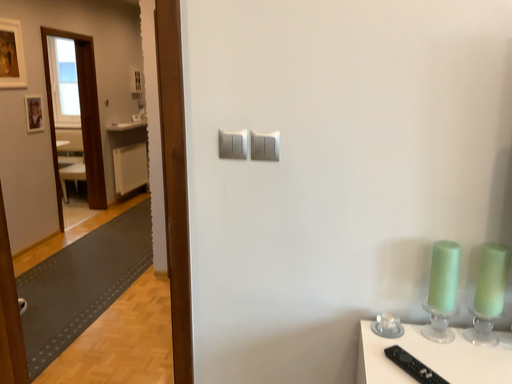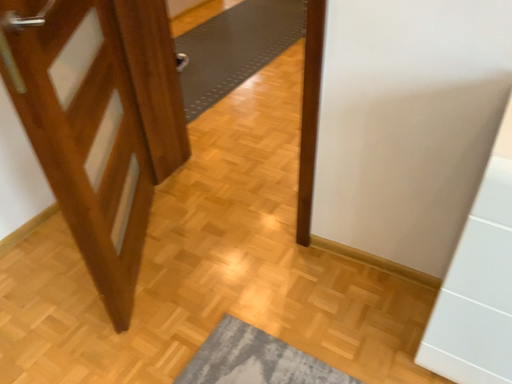
Question: Which way did the camera rotate in the video?

Choices:
 (A) rotated left
 (B) rotated right

Answer: (A)